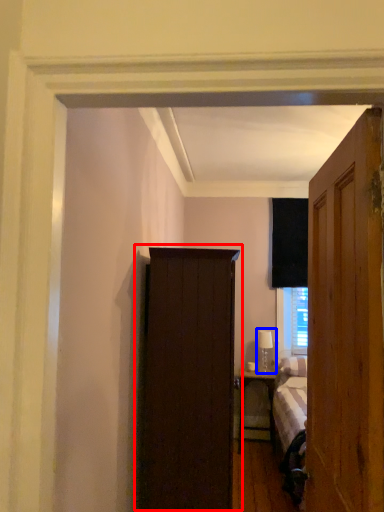
Question: Among these objects, which one is nearest to the camera, cupboard (highlighted by a red box) or table lamp (highlighted by a blue box)?

Choices:
 (A) cupboard
 (B) table lamp

Answer: (A)